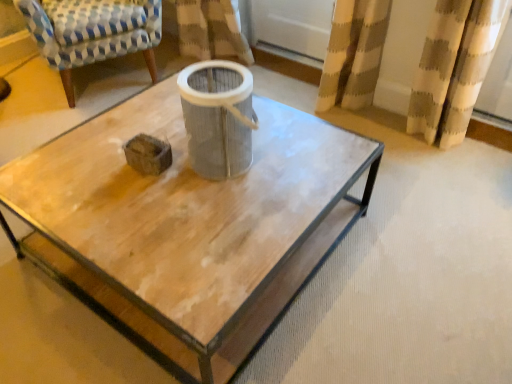
Question: Choose the correct answer: Is gray fabric filter at center inside wooden coffee table at center or outside it?

Choices:
 (A) outside
 (B) inside

Answer: (A)

Question: Is gray fabric filter at center taller or shorter than wooden coffee table at center?

Choices:
 (A) short
 (B) tall

Answer: (B)

Question: Estimate the real-world distances between objects in this image. Which object is closer to the wooden coffee table at center?

Choices:
 (A) blue and white checkered fabric armchair at upper left
 (B) gray fabric filter at center

Answer: (B)

Question: Which of these objects is positioned farthest from the blue and white checkered fabric armchair at upper left?

Choices:
 (A) gray fabric filter at center
 (B) wooden coffee table at center

Answer: (A)